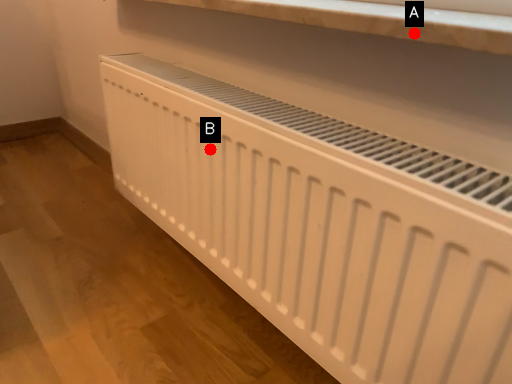
Question: Two points are circled on the image, labeled by A and B beside each circle. Which point is closer to the camera?

Choices:
 (A) A is closer
 (B) B is closer

Answer: (A)